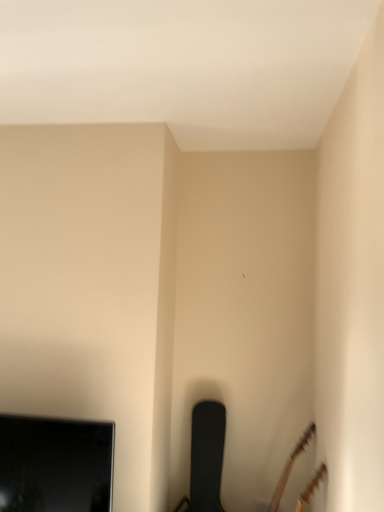
What is the approximate width of black textured chair at lower center?

It is 10.06 inches.

The height and width of the screenshot is (512, 384). Describe the element at coordinates (206, 457) in the screenshot. I see `black textured chair at lower center` at that location.

In order to face brown matte guitar at lower right, should I rotate leftwards or rightwards?

To face it directly, rotate right by 11.828 degrees.

At what (x,y) coordinates should I click in order to perform the action: click on brown matte guitar at lower right. Please return your answer as a coordinate pair (x, y). The height and width of the screenshot is (512, 384). Looking at the image, I should click on (290, 466).

This screenshot has width=384, height=512. Identify the location of black textured chair at lower center. (206, 457).

From a real-world perspective, is black textured chair at lower center above or below black glossy television at lower left?

Clearly, from a real-world perspective, black textured chair at lower center is below black glossy television at lower left.

Does black textured chair at lower center appear on the right side of black glossy television at lower left?

Correct, you'll find black textured chair at lower center to the right of black glossy television at lower left.

At what (x,y) coordinates should I click in order to perform the action: click on television above the black textured chair at lower center (from the image's perspective). Please return your answer as a coordinate pair (x, y). This screenshot has width=384, height=512. Looking at the image, I should click on (55, 465).

Is black glossy television at lower left positioned beyond the bounds of brown matte guitar at lower right?

Indeed, black glossy television at lower left is completely outside brown matte guitar at lower right.

From the image's perspective, is black glossy television at lower left above brown matte guitar at lower right?

Yes, from the image's perspective, black glossy television at lower left is above brown matte guitar at lower right.

From the picture: Looking at their sizes, would you say black glossy television at lower left is wider or thinner than brown matte guitar at lower right?

black glossy television at lower left is thinner than brown matte guitar at lower right.

From a real-world perspective, which object stands above the other?

black glossy television at lower left is physically above.

Considering the positions of objects brown matte guitar at lower right and black textured chair at lower center in the image provided, who is more to the left, brown matte guitar at lower right or black textured chair at lower center?

From the viewer's perspective, black textured chair at lower center appears more on the left side.

Is brown matte guitar at lower right beside black textured chair at lower center?

brown matte guitar at lower right and black textured chair at lower center are clearly separated.

Between brown matte guitar at lower right and black textured chair at lower center, which one is positioned behind?

black textured chair at lower center is further away from the camera.

Looking at this image, can you confirm if brown matte guitar at lower right is taller than black textured chair at lower center?

In fact, brown matte guitar at lower right may be shorter than black textured chair at lower center.

Would you consider black glossy television at lower left to be distant from black textured chair at lower center?

black glossy television at lower left is actually quite close to black textured chair at lower center.

Is black glossy television at lower left further to camera compared to black textured chair at lower center?

No, black glossy television at lower left is closer to the camera.

Between point (11, 418) and point (203, 465), which one is positioned behind?

The point (203, 465) is farther from the camera.

In the scene shown: Considering the sizes of objects black textured chair at lower center and brown matte guitar at lower right in the image provided, who is bigger, black textured chair at lower center or brown matte guitar at lower right?

Bigger between the two is brown matte guitar at lower right.

Can you confirm if black textured chair at lower center is shorter than brown matte guitar at lower right?

No.

This screenshot has width=384, height=512. Identify the location of chair located behind the brown matte guitar at lower right. (206, 457).

How far apart are brown matte guitar at lower right and black glossy television at lower left?

The distance of brown matte guitar at lower right from black glossy television at lower left is 1.19 meters.

From a real-world perspective, which object rests below the other?

In real-world perspective, brown matte guitar at lower right is lower.

Is brown matte guitar at lower right positioned with its back to black glossy television at lower left?

brown matte guitar at lower right does not have its back to black glossy television at lower left.

Can we say brown matte guitar at lower right lies outside black glossy television at lower left?

Absolutely, brown matte guitar at lower right is external to black glossy television at lower left.

Where is `television in front of the black textured chair at lower center`? This screenshot has height=512, width=384. television in front of the black textured chair at lower center is located at coordinates pos(55,465).

Where is `guitar behind the black glossy television at lower left`? This screenshot has height=512, width=384. guitar behind the black glossy television at lower left is located at coordinates (290, 466).

Which object lies nearer to the anchor point black textured chair at lower center, black glossy television at lower left or brown matte guitar at lower right?

brown matte guitar at lower right is positioned closer to the anchor black textured chair at lower center.

Based on the photo, which object lies further to the anchor point brown matte guitar at lower right, black textured chair at lower center or black glossy television at lower left?

black glossy television at lower left is positioned further to the anchor brown matte guitar at lower right.

Considering their positions, is black textured chair at lower center positioned further to black glossy television at lower left than brown matte guitar at lower right?

The object further to black glossy television at lower left is brown matte guitar at lower right.

Estimate the real-world distances between objects in this image. Which object is further from black textured chair at lower center, brown matte guitar at lower right or black glossy television at lower left?

black glossy television at lower left is positioned further to the anchor black textured chair at lower center.

Considering their positions, is black glossy television at lower left positioned further to brown matte guitar at lower right than black textured chair at lower center?

Based on the image, black glossy television at lower left appears to be further to brown matte guitar at lower right.

Looking at the image, which one is located further to black glossy television at lower left, brown matte guitar at lower right or black textured chair at lower center?

Based on the image, brown matte guitar at lower right appears to be further to black glossy television at lower left.

The image size is (384, 512). What are the coordinates of `chair located between black glossy television at lower left and brown matte guitar at lower right in the left-right direction` in the screenshot? It's located at click(206, 457).